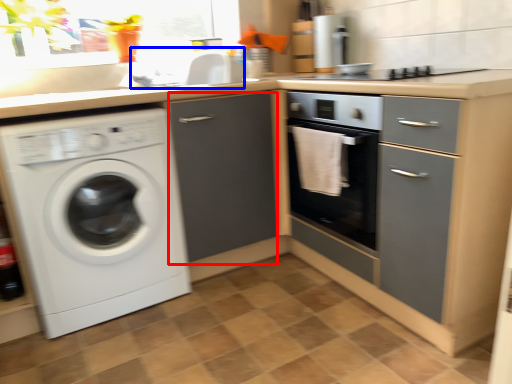
Question: Which object is further to the camera taking this photo, file cabinet (highlighted by a red box) or sink (highlighted by a blue box)?

Choices:
 (A) file cabinet
 (B) sink

Answer: (B)